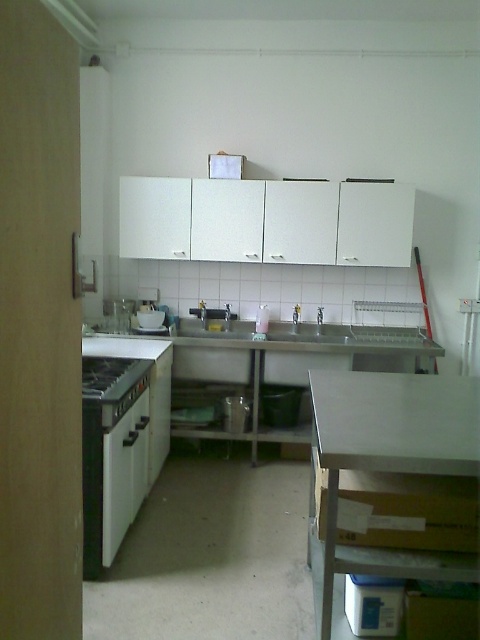
Is stainless steel counter top at center above satin silver sink at center?

No, stainless steel counter top at center is not above satin silver sink at center.

Is stainless steel counter top at center taller than satin silver sink at center?

Yes, stainless steel counter top at center is taller than satin silver sink at center.

Which is behind, point (168, 422) or point (245, 332)?

The point (245, 332) is behind.

At what (x,y) coordinates should I click in order to perform the action: click on stainless steel counter top at center. Please return your answer as a coordinate pair (x, y). Looking at the image, I should click on (279, 362).

Does black matte oven at left have a larger size compared to black matte stove at lower left?

Indeed, black matte oven at left has a larger size compared to black matte stove at lower left.

Is point (84, 381) less distant than point (128, 376)?

That is True.

Which is behind, point (111, 403) or point (135, 376)?

Positioned behind is point (135, 376).

At what (x,y) coordinates should I click in order to perform the action: click on black matte oven at left. Please return your answer as a coordinate pair (x, y). The width and height of the screenshot is (480, 640). Looking at the image, I should click on (112, 452).

Does stainless steel counter top at center have a smaller size compared to black matte oven at left?

Incorrect, stainless steel counter top at center is not smaller in size than black matte oven at left.

Can you confirm if stainless steel counter top at center is wider than black matte oven at left?

Indeed, stainless steel counter top at center has a greater width compared to black matte oven at left.

Between point (194, 380) and point (121, 388), which one is positioned in front?

Point (121, 388) is more forward.

The height and width of the screenshot is (640, 480). What are the coordinates of `stainless steel counter top at center` in the screenshot? It's located at (279, 362).